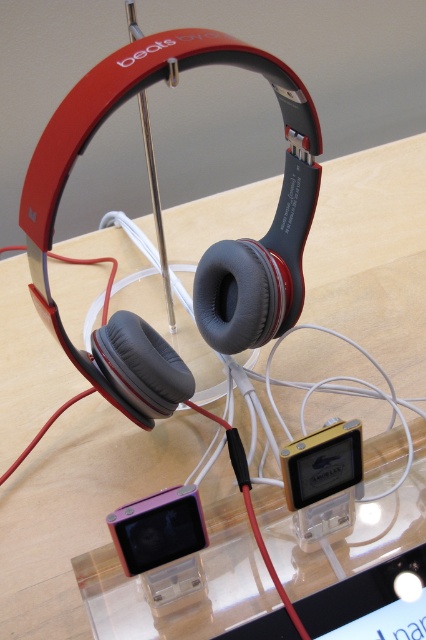
Question: Does pink glossy ipod at lower center appear over metallic pink ipod at center?

Choices:
 (A) yes
 (B) no

Answer: (B)

Question: Can you confirm if pink glossy ipod at lower center is smaller than metallic pink ipod at center?

Choices:
 (A) no
 (B) yes

Answer: (A)

Question: Which object appears closest to the camera in this image?

Choices:
 (A) metallic pink ipod at center
 (B) pink glossy ipod at lower center

Answer: (B)

Question: Considering the relative positions of pink glossy ipod at lower center and metallic pink ipod at center in the image provided, where is pink glossy ipod at lower center located with respect to metallic pink ipod at center?

Choices:
 (A) right
 (B) left

Answer: (B)

Question: Which object is closer to the camera taking this photo?

Choices:
 (A) metallic pink ipod at center
 (B) pink glossy ipod at lower center

Answer: (B)